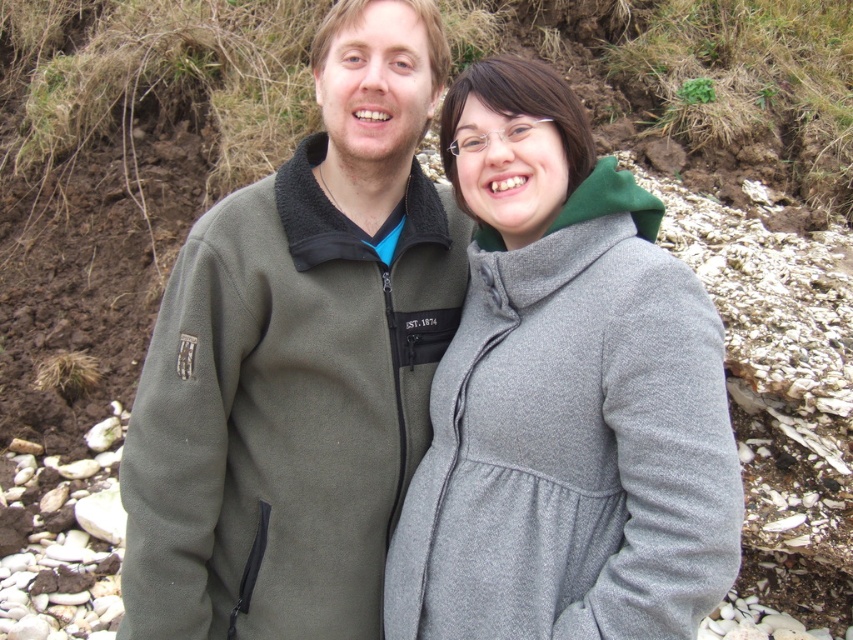
You are a photographer setting up for a group photo. You need to ensure that both the green fleece jacket at center and the gray woolen coat at center are clearly visible in the frame. Given their sizes, which of the two should you position closer to the camera to maintain their visibility?

The gray woolen coat at center is smaller in size compared to the green fleece jacket at center. To ensure both are clearly visible, position the gray woolen coat at center closer to the camera so its smaller size is compensated by proximity, while the larger green fleece jacket at center can be slightly farther back but still within the frame.

Based on the scene description, which object is taller between the green fleece jacket at center and the gray woolen coat at center?

The green fleece jacket at center is much taller than the gray woolen coat at center according to the description.

You are a photographer trying to capture a photo of the two people in the image. You want to ensure that both the green fleece jacket at center and the gray woolen coat at center are clearly visible in the frame. Based on their positions, which jacket is closer to the left edge of the photo?

The green fleece jacket at center is to the left of the gray woolen coat at center, so it is closer to the left edge of the photo.